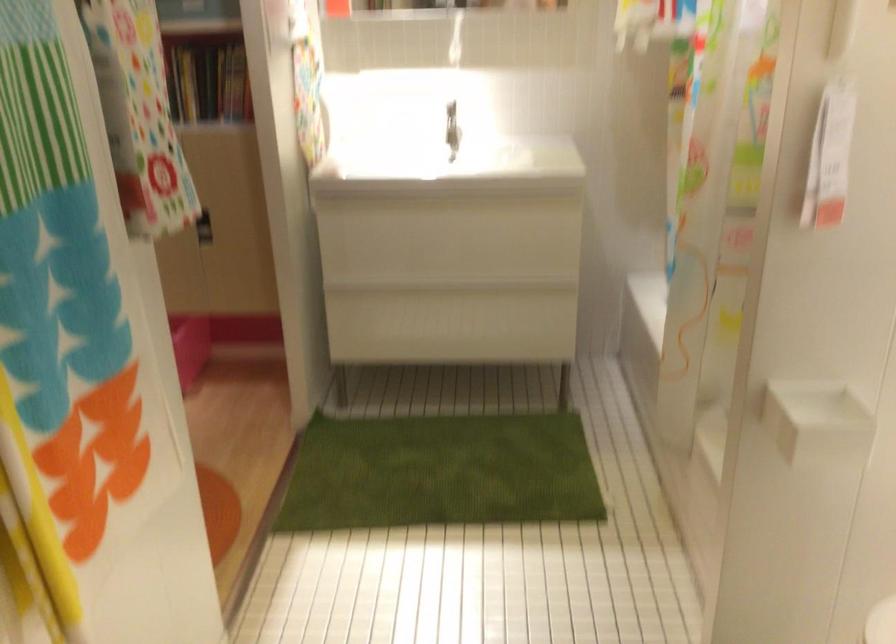
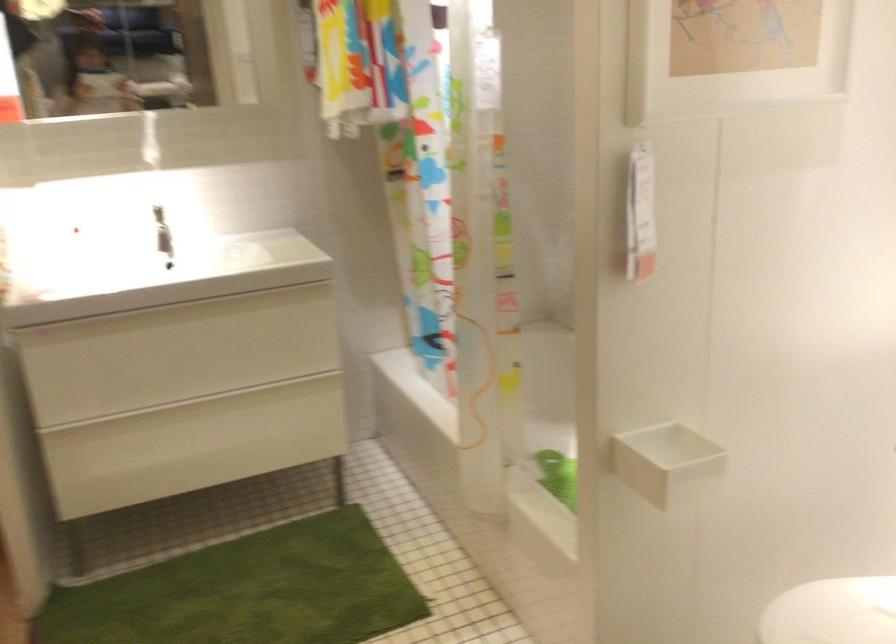
In a continuous first-person perspective shot, in which direction is the camera moving?

The cameraman walked toward left, forward.